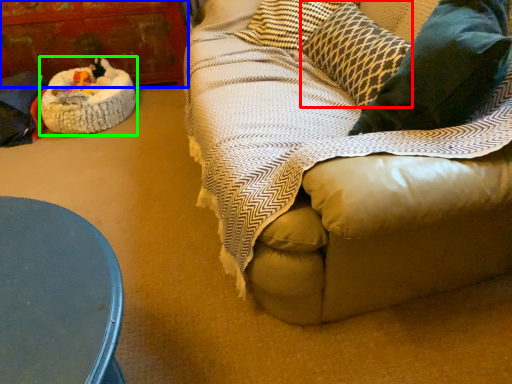
Question: Which object is positioned closest to pillow (highlighted by a red box)? Select from armoire (highlighted by a blue box) and cat bed (highlighted by a green box).

Choices:
 (A) armoire
 (B) cat bed

Answer: (B)